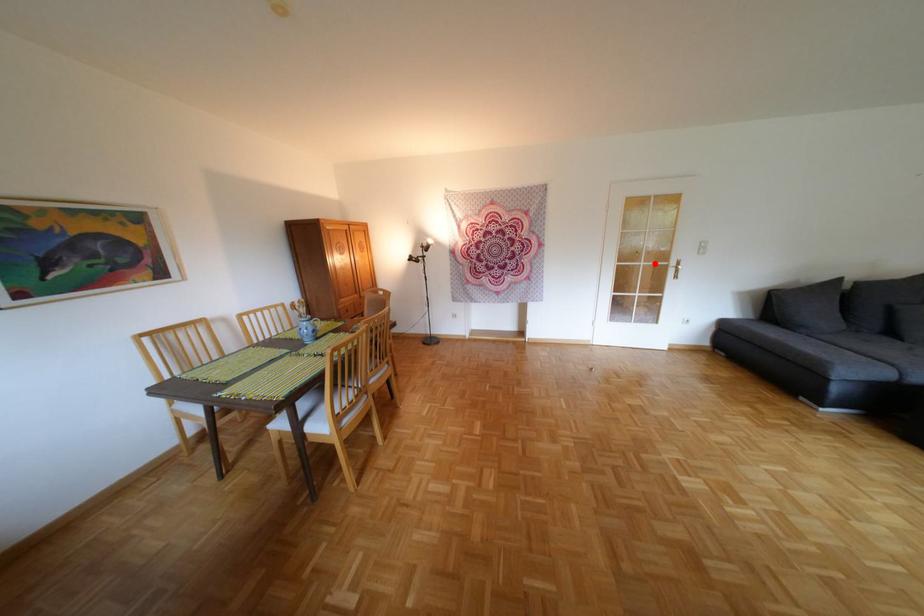
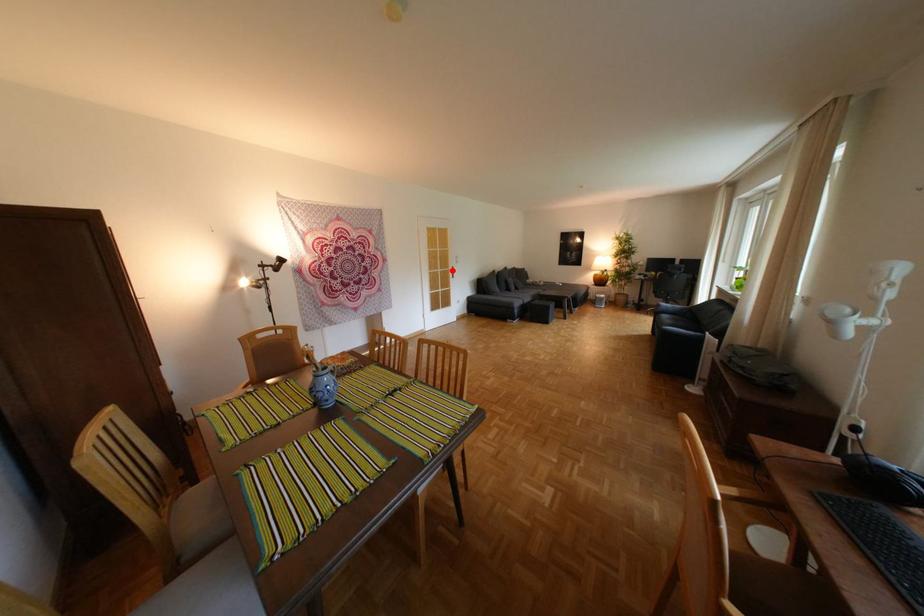
I am providing you with two images of the same scene from different viewpoints. A red point is marked on the first image and another point is marked on the second image. Is the red point in image1 aligned with the point shown in image2?

Yes